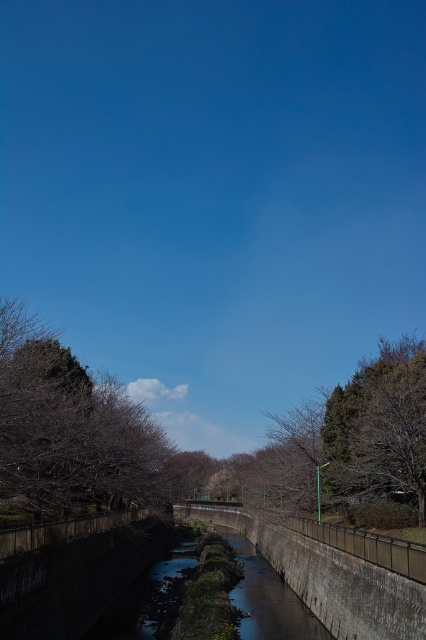
What do you see at coordinates (68, 428) in the screenshot? This screenshot has height=640, width=426. I see `brown leafless branches at upper left` at bounding box center [68, 428].

Can you confirm if brown leafless branches at upper left is positioned to the right of green metallic pole at center-right?

In fact, brown leafless branches at upper left is to the left of green metallic pole at center-right.

This screenshot has height=640, width=426. Identify the location of brown leafless branches at upper left. (68, 428).

From the picture: Between green metallic pole at center-right and clear water at center, which one has more height?

green metallic pole at center-right is taller.

Does green metallic pole at center-right appear under clear water at center?

Actually, green metallic pole at center-right is above clear water at center.

Is point (368, 484) closer to camera compared to point (230, 536)?

Yes, point (368, 484) is closer to viewer.

This screenshot has height=640, width=426. I want to click on green metallic pole at center-right, so click(x=362, y=429).

Who is more forward, (39, 465) or (262, 586)?

Point (39, 465) is more forward.

Which is below, brown leafless branches at upper left or clear water at center?

clear water at center is below.

Is point (86, 429) closer to camera compared to point (270, 634)?

No, (86, 429) is further to viewer.

Locate an element on the screen. brown leafless branches at upper left is located at coordinates point(68,428).